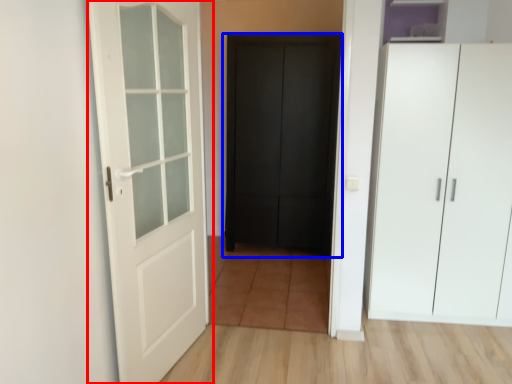
Question: Which point is closer to the camera, door (highlighted by a red box) or door (highlighted by a blue box)?

Choices:
 (A) door
 (B) door

Answer: (A)